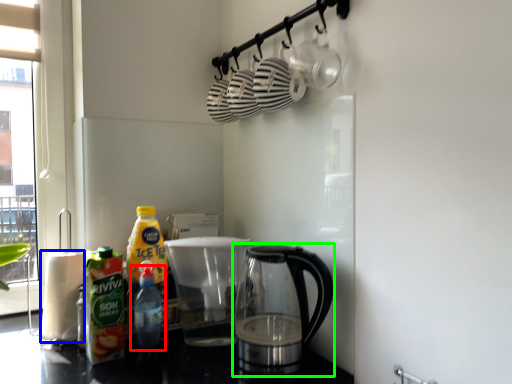
Question: Which object is positioned farthest from bottle (highlighted by a red box)? Select from paper towel (highlighted by a blue box) and kettle (highlighted by a green box).

Choices:
 (A) paper towel
 (B) kettle

Answer: (B)